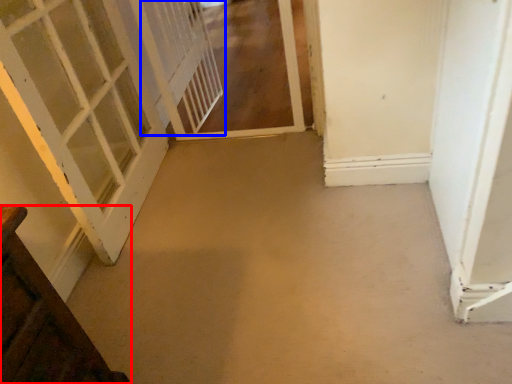
Question: Which of the following is the closest to the observer, door (highlighted by a red box) or screen door (highlighted by a blue box)?

Choices:
 (A) door
 (B) screen door

Answer: (A)